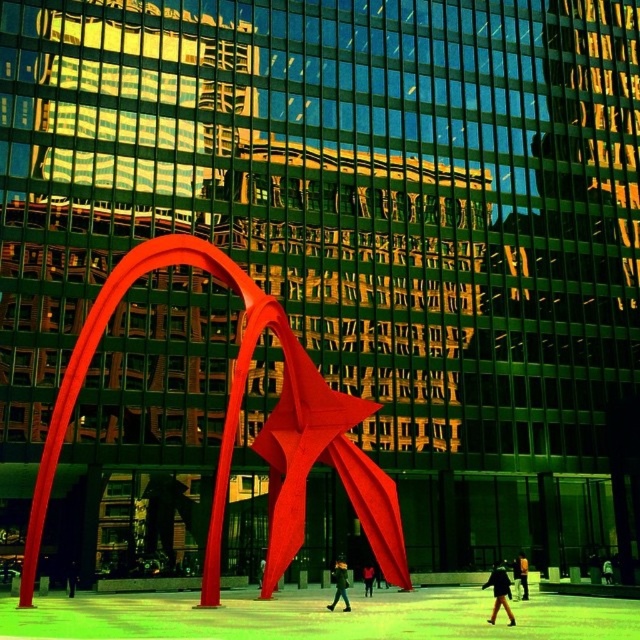
Question: Observing the image, what is the correct spatial positioning of dark green fabric jacket at center in reference to black leather jacket at center?

Choices:
 (A) right
 (B) left

Answer: (B)

Question: Does black leather jacket at center appear under black leather jacket at lower center?

Choices:
 (A) no
 (B) yes

Answer: (A)

Question: Among these objects, which one is nearest to the camera?

Choices:
 (A) dark brown leather jacket at lower right
 (B) black fabric person at center
 (C) dark green fabric jacket at center
 (D) dark green fabric jacket at lower right

Answer: (A)

Question: Which is nearer to the dark green fabric jacket at lower right?

Choices:
 (A) black leather jacket at center
 (B) black leather jacket at lower center
 (C) dark green fabric jacket at center

Answer: (B)

Question: Estimate the real-world distances between objects in this image. Which object is farther from the black leather jacket at center?

Choices:
 (A) black fabric person at center
 (B) dark green fabric jacket at center
 (C) black leather jacket at lower center
 (D) dark brown leather jacket at lower right

Answer: (A)

Question: Does dark green fabric jacket at lower right come behind black fabric person at center?

Choices:
 (A) no
 (B) yes

Answer: (A)